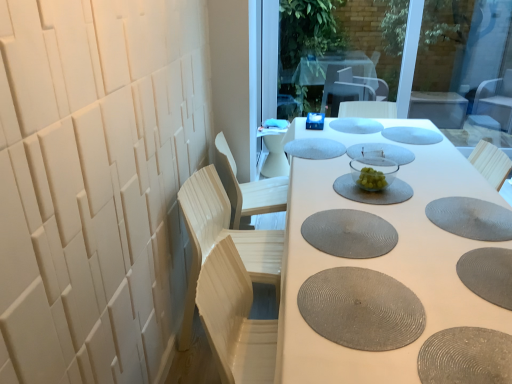
Identify the location of free space between gray textured placemat at lower right, which is the fifth manhole cover from front to back, and gray rubber mat at center, which appears as the 2th manhole cover when viewed from the back. Image resolution: width=512 pixels, height=384 pixels. (439, 170).